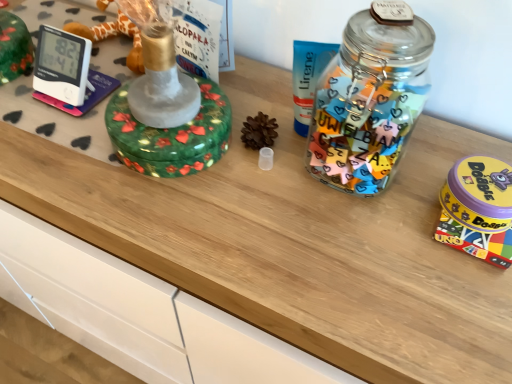
This screenshot has height=384, width=512. Identify the location of free space in front of yellow plastic game at right, the 1th toy when ordered from right to left. coord(447,306).